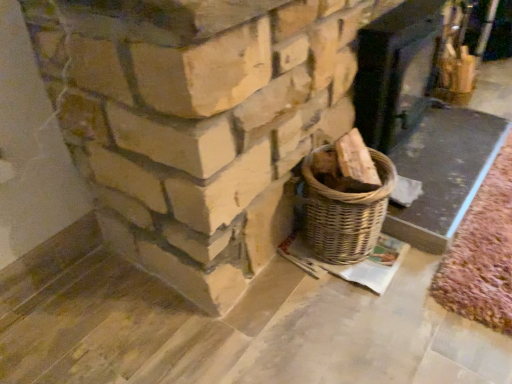
The height and width of the screenshot is (384, 512). What do you see at coordinates (395, 71) in the screenshot?
I see `smooth dark wood fireplace at upper right, acting as the first fireplace starting from the right` at bounding box center [395, 71].

Find the location of a particular element. The image size is (512, 384). smooth dark wood fireplace at upper right, acting as the first fireplace starting from the right is located at coordinates (395, 71).

What do you see at coordinates (196, 122) in the screenshot?
I see `natural stone fireplace at upper left, acting as the 2th fireplace starting from the right` at bounding box center [196, 122].

The image size is (512, 384). I want to click on natural stone fireplace at upper left, which ranks as the 1th fireplace in left-to-right order, so click(x=196, y=122).

Find the location of a particular element. The image size is (512, 384). smooth dark wood fireplace at upper right, acting as the first fireplace starting from the right is located at coordinates (395, 71).

Which is more to the left, smooth dark wood fireplace at upper right, which is the 2th fireplace in left-to-right order, or natural stone fireplace at upper left, acting as the 2th fireplace starting from the right?

natural stone fireplace at upper left, acting as the 2th fireplace starting from the right.

Is the position of smooth dark wood fireplace at upper right, which is the 2th fireplace in left-to-right order, more distant than that of natural stone fireplace at upper left, which ranks as the 1th fireplace in left-to-right order?

Yes, it is behind natural stone fireplace at upper left, which ranks as the 1th fireplace in left-to-right order.

Is point (396, 53) farther from viewer compared to point (154, 211)?

Yes.

From the image's perspective, which one is positioned lower, smooth dark wood fireplace at upper right, which is the 2th fireplace in left-to-right order, or natural stone fireplace at upper left, which ranks as the 1th fireplace in left-to-right order?

natural stone fireplace at upper left, which ranks as the 1th fireplace in left-to-right order.

From a real-world perspective, which is physically below, smooth dark wood fireplace at upper right, which is the 2th fireplace in left-to-right order, or natural stone fireplace at upper left, acting as the 2th fireplace starting from the right?

In real-world perspective, smooth dark wood fireplace at upper right, which is the 2th fireplace in left-to-right order, is lower.

Which object is thinner, smooth dark wood fireplace at upper right, which is the 2th fireplace in left-to-right order, or natural stone fireplace at upper left, which ranks as the 1th fireplace in left-to-right order?

natural stone fireplace at upper left, which ranks as the 1th fireplace in left-to-right order.

Is smooth dark wood fireplace at upper right, acting as the first fireplace starting from the right, taller or shorter than natural stone fireplace at upper left, which ranks as the 1th fireplace in left-to-right order?

smooth dark wood fireplace at upper right, acting as the first fireplace starting from the right, is shorter than natural stone fireplace at upper left, which ranks as the 1th fireplace in left-to-right order.

Is smooth dark wood fireplace at upper right, which is the 2th fireplace in left-to-right order, bigger than natural stone fireplace at upper left, acting as the 2th fireplace starting from the right?

Yes.

Is smooth dark wood fireplace at upper right, acting as the first fireplace starting from the right, completely or partially outside of natural stone fireplace at upper left, acting as the 2th fireplace starting from the right?

Yes, smooth dark wood fireplace at upper right, acting as the first fireplace starting from the right, is located beyond the bounds of natural stone fireplace at upper left, acting as the 2th fireplace starting from the right.

Is there a large distance between smooth dark wood fireplace at upper right, which is the 2th fireplace in left-to-right order, and natural stone fireplace at upper left, acting as the 2th fireplace starting from the right?

No.

Could you tell me if smooth dark wood fireplace at upper right, acting as the first fireplace starting from the right, is turned towards natural stone fireplace at upper left, which ranks as the 1th fireplace in left-to-right order?

No, smooth dark wood fireplace at upper right, acting as the first fireplace starting from the right, is not facing towards natural stone fireplace at upper left, which ranks as the 1th fireplace in left-to-right order.

What's the angular difference between smooth dark wood fireplace at upper right, which is the 2th fireplace in left-to-right order, and natural stone fireplace at upper left, which ranks as the 1th fireplace in left-to-right order,'s facing directions?

There is a 92.7-degree angle between the facing directions of smooth dark wood fireplace at upper right, which is the 2th fireplace in left-to-right order, and natural stone fireplace at upper left, which ranks as the 1th fireplace in left-to-right order.

At what (x,y) coordinates should I click in order to perform the action: click on fireplace below the smooth dark wood fireplace at upper right, acting as the first fireplace starting from the right (from the image's perspective). Please return your answer as a coordinate pair (x, y). Looking at the image, I should click on (196, 122).

Is natural stone fireplace at upper left, which ranks as the 1th fireplace in left-to-right order, at the right side of smooth dark wood fireplace at upper right, which is the 2th fireplace in left-to-right order?

In fact, natural stone fireplace at upper left, which ranks as the 1th fireplace in left-to-right order, is to the left of smooth dark wood fireplace at upper right, which is the 2th fireplace in left-to-right order.

Is natural stone fireplace at upper left, acting as the 2th fireplace starting from the right, positioned before smooth dark wood fireplace at upper right, acting as the first fireplace starting from the right?

Yes, natural stone fireplace at upper left, acting as the 2th fireplace starting from the right, is in front of smooth dark wood fireplace at upper right, acting as the first fireplace starting from the right.

Does point (195, 61) appear closer or farther from the camera than point (382, 35)?

Point (195, 61) appears to be closer to the viewer than point (382, 35).

From the image's perspective, who appears lower, natural stone fireplace at upper left, which ranks as the 1th fireplace in left-to-right order, or smooth dark wood fireplace at upper right, which is the 2th fireplace in left-to-right order?

natural stone fireplace at upper left, which ranks as the 1th fireplace in left-to-right order, is shown below in the image.

From a real-world perspective, is natural stone fireplace at upper left, acting as the 2th fireplace starting from the right, positioned above or below smooth dark wood fireplace at upper right, acting as the first fireplace starting from the right?

natural stone fireplace at upper left, acting as the 2th fireplace starting from the right, is situated higher than smooth dark wood fireplace at upper right, acting as the first fireplace starting from the right, in the real world.

Considering the relative sizes of natural stone fireplace at upper left, acting as the 2th fireplace starting from the right, and smooth dark wood fireplace at upper right, acting as the first fireplace starting from the right, in the image provided, is natural stone fireplace at upper left, acting as the 2th fireplace starting from the right, thinner than smooth dark wood fireplace at upper right, acting as the first fireplace starting from the right,?

Indeed, natural stone fireplace at upper left, acting as the 2th fireplace starting from the right, has a lesser width compared to smooth dark wood fireplace at upper right, acting as the first fireplace starting from the right.

Who is taller, natural stone fireplace at upper left, which ranks as the 1th fireplace in left-to-right order, or smooth dark wood fireplace at upper right, acting as the first fireplace starting from the right?

Standing taller between the two is natural stone fireplace at upper left, which ranks as the 1th fireplace in left-to-right order.

Considering the relative sizes of natural stone fireplace at upper left, which ranks as the 1th fireplace in left-to-right order, and smooth dark wood fireplace at upper right, which is the 2th fireplace in left-to-right order, in the image provided, is natural stone fireplace at upper left, which ranks as the 1th fireplace in left-to-right order, bigger than smooth dark wood fireplace at upper right, which is the 2th fireplace in left-to-right order,?

No.

Is natural stone fireplace at upper left, acting as the 2th fireplace starting from the right, located outside smooth dark wood fireplace at upper right, which is the 2th fireplace in left-to-right order?

That's correct, natural stone fireplace at upper left, acting as the 2th fireplace starting from the right, is outside of smooth dark wood fireplace at upper right, which is the 2th fireplace in left-to-right order.

Is natural stone fireplace at upper left, acting as the 2th fireplace starting from the right, positioned far away from smooth dark wood fireplace at upper right, which is the 2th fireplace in left-to-right order?

No, natural stone fireplace at upper left, acting as the 2th fireplace starting from the right, is in close proximity to smooth dark wood fireplace at upper right, which is the 2th fireplace in left-to-right order.

Is natural stone fireplace at upper left, which ranks as the 1th fireplace in left-to-right order, looking in the opposite direction of smooth dark wood fireplace at upper right, acting as the first fireplace starting from the right?

That's right, natural stone fireplace at upper left, which ranks as the 1th fireplace in left-to-right order, is facing away from smooth dark wood fireplace at upper right, acting as the first fireplace starting from the right.

Identify the location of fireplace above the smooth dark wood fireplace at upper right, acting as the first fireplace starting from the right (from a real-world perspective). The height and width of the screenshot is (384, 512). (196, 122).

The width and height of the screenshot is (512, 384). In order to click on fireplace that appears behind the natural stone fireplace at upper left, acting as the 2th fireplace starting from the right in this screenshot , I will do `click(395, 71)`.

Find the location of a particular element. fireplace lying on the left of smooth dark wood fireplace at upper right, which is the 2th fireplace in left-to-right order is located at coordinates (196, 122).